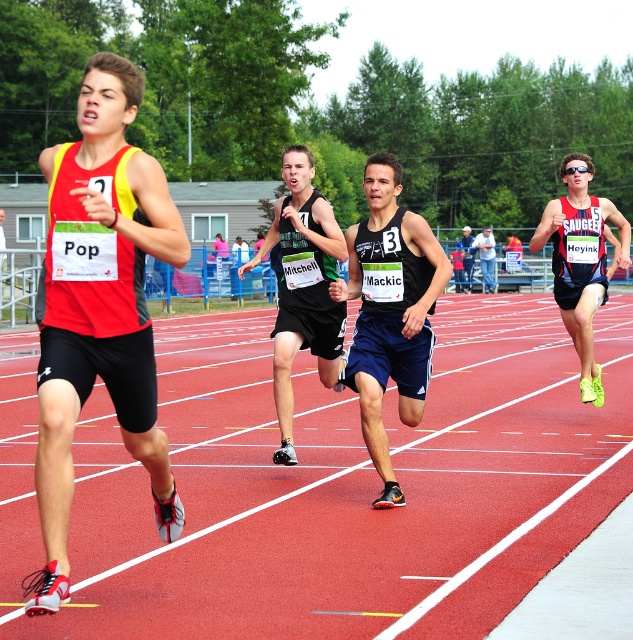
Question: Which point appears farthest from the camera in this image?

Choices:
 (A) (489, 248)
 (B) (289, 237)
 (C) (601, 289)

Answer: (A)

Question: Does neon green running shoe at right have a larger size compared to matte black tank top at center?

Choices:
 (A) no
 (B) yes

Answer: (B)

Question: In this image, where is rubberized red track at center located relative to matte red tank top at left?

Choices:
 (A) below
 (B) above

Answer: (A)

Question: Which point appears closest to the camera in this image?

Choices:
 (A) (484, 246)
 (B) (396, 241)

Answer: (B)

Question: Can you confirm if rubberized red track at center is wider than denim jacket at center?

Choices:
 (A) yes
 (B) no

Answer: (A)

Question: Which point is farther from the camera taking this photo?

Choices:
 (A) (427, 264)
 (B) (468, 253)
 (C) (587, 310)

Answer: (B)